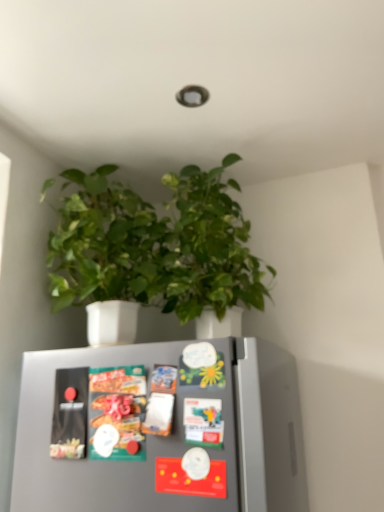
Question: Considering the relative sizes of metallic silver fridge magnets at center and green matte plant at upper center in the image provided, is metallic silver fridge magnets at center smaller than green matte plant at upper center?

Choices:
 (A) no
 (B) yes

Answer: (B)

Question: From a real-world perspective, is metallic silver fridge magnets at center beneath green matte plant at upper center?

Choices:
 (A) yes
 (B) no

Answer: (A)

Question: Would you say metallic silver fridge magnets at center is a long distance from green matte plant at upper center?

Choices:
 (A) yes
 (B) no

Answer: (B)

Question: Considering the relative sizes of metallic silver fridge magnets at center and green matte plant at upper center in the image provided, is metallic silver fridge magnets at center bigger than green matte plant at upper center?

Choices:
 (A) no
 (B) yes

Answer: (A)

Question: Is metallic silver fridge magnets at center completely or partially outside of green matte plant at upper center?

Choices:
 (A) yes
 (B) no

Answer: (A)

Question: Considering the relative sizes of metallic silver fridge magnets at center and green matte plant at upper center in the image provided, is metallic silver fridge magnets at center taller than green matte plant at upper center?

Choices:
 (A) yes
 (B) no

Answer: (B)

Question: From a real-world perspective, does metallic silver fridge magnets at center sit lower than matte plastic snack packet at center?

Choices:
 (A) no
 (B) yes

Answer: (B)

Question: Considering the relative sizes of metallic silver fridge magnets at center and matte plastic snack packet at center in the image provided, is metallic silver fridge magnets at center thinner than matte plastic snack packet at center?

Choices:
 (A) yes
 (B) no

Answer: (A)

Question: Is metallic silver fridge magnets at center taller than matte plastic snack packet at center?

Choices:
 (A) yes
 (B) no

Answer: (A)

Question: Is metallic silver fridge magnets at center oriented away from matte plastic snack packet at center?

Choices:
 (A) yes
 (B) no

Answer: (A)

Question: Does metallic silver fridge magnets at center turn towards matte plastic snack packet at center?

Choices:
 (A) yes
 (B) no

Answer: (A)

Question: Can you confirm if metallic silver fridge magnets at center is bigger than matte plastic snack packet at center?

Choices:
 (A) yes
 (B) no

Answer: (A)

Question: Does matte plastic snack packet at center turn towards green matte plant at upper center?

Choices:
 (A) yes
 (B) no

Answer: (B)